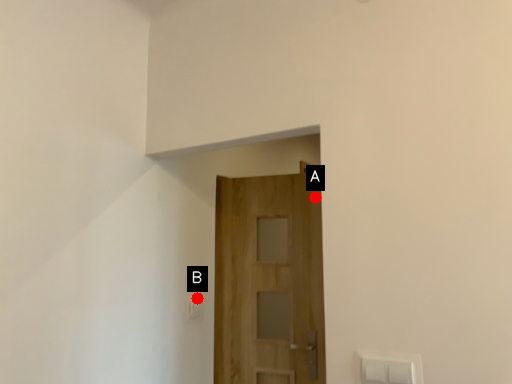
Question: Two points are circled on the image, labeled by A and B beside each circle. Which point is farther to the camera?

Choices:
 (A) A is further
 (B) B is further

Answer: (A)